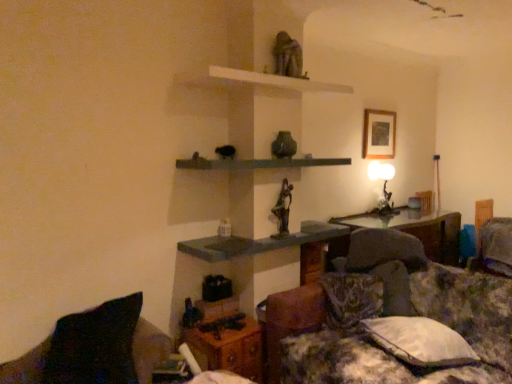
Question: From a real-world perspective, is black fabric pillow at lower left, the 1th pillow positioned from the left, physically below matte black table lamp at upper right?

Choices:
 (A) yes
 (B) no

Answer: (A)

Question: From the image's perspective, would you say black fabric pillow at lower left, the 1th pillow positioned from the left, is shown under matte black table lamp at upper right?

Choices:
 (A) no
 (B) yes

Answer: (B)

Question: Considering the relative sizes of black fabric pillow at lower left, marked as the third pillow in a right-to-left arrangement, and matte black table lamp at upper right in the image provided, is black fabric pillow at lower left, marked as the third pillow in a right-to-left arrangement, wider than matte black table lamp at upper right?

Choices:
 (A) yes
 (B) no

Answer: (A)

Question: Is black fabric pillow at lower left, the 1th pillow positioned from the left, turned away from matte black table lamp at upper right?

Choices:
 (A) yes
 (B) no

Answer: (B)

Question: Does black fabric pillow at lower left, which is the third pillow in back-to-front order, contain matte black table lamp at upper right?

Choices:
 (A) yes
 (B) no

Answer: (B)

Question: Does black fabric pillow at lower left, marked as the third pillow in a right-to-left arrangement, turn towards matte black table lamp at upper right?

Choices:
 (A) yes
 (B) no

Answer: (B)

Question: Can you confirm if white fabric pillow at lower right, the second pillow from the left, is wider than bronze statue at center, placed as the second sculpture when sorted from top to bottom?

Choices:
 (A) yes
 (B) no

Answer: (A)

Question: From the image's perspective, does white fabric pillow at lower right, the second pillow positioned from the front, appear lower than bronze statue at center, positioned as the 1th sculpture in bottom-to-top order?

Choices:
 (A) yes
 (B) no

Answer: (A)

Question: Is white fabric pillow at lower right, which is the 2th pillow in right-to-left order, taller than bronze statue at center, positioned as the 1th sculpture in bottom-to-top order?

Choices:
 (A) yes
 (B) no

Answer: (B)

Question: Does white fabric pillow at lower right, which is the 2th pillow in right-to-left order, have a lesser width compared to bronze statue at center, placed as the second sculpture when sorted from top to bottom?

Choices:
 (A) no
 (B) yes

Answer: (A)

Question: Is white fabric pillow at lower right, which ranks as the 2th pillow in back-to-front order, positioned far away from bronze statue at center, positioned as the 1th sculpture in bottom-to-top order?

Choices:
 (A) no
 (B) yes

Answer: (B)

Question: Can you confirm if white fabric pillow at lower right, which is the 2th pillow in right-to-left order, is shorter than bronze statue at center, positioned as the 1th sculpture in bottom-to-top order?

Choices:
 (A) no
 (B) yes

Answer: (B)

Question: Is there a large distance between wooden picture frame at upper center and white fabric pillow at lower right, which ranks as the 2th pillow in back-to-front order?

Choices:
 (A) yes
 (B) no

Answer: (A)